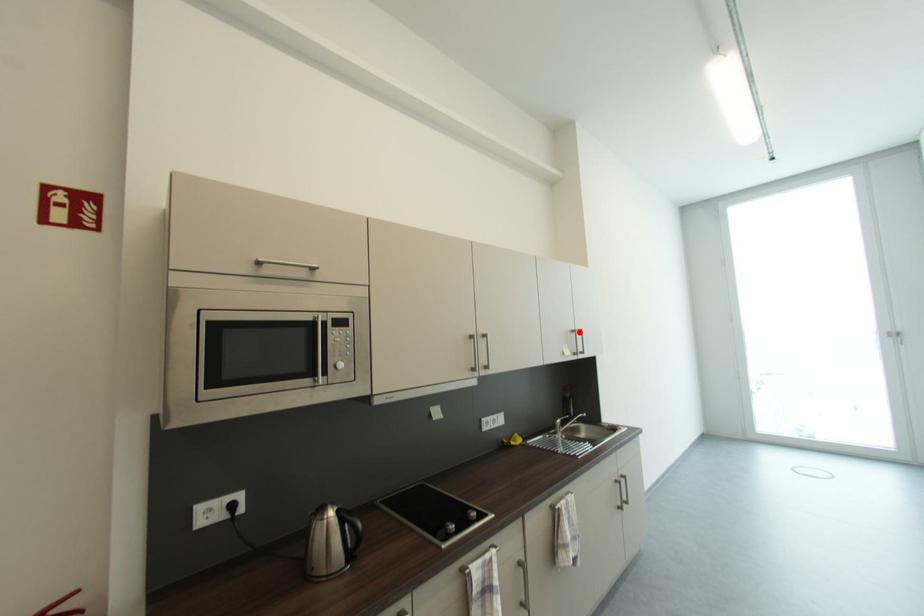
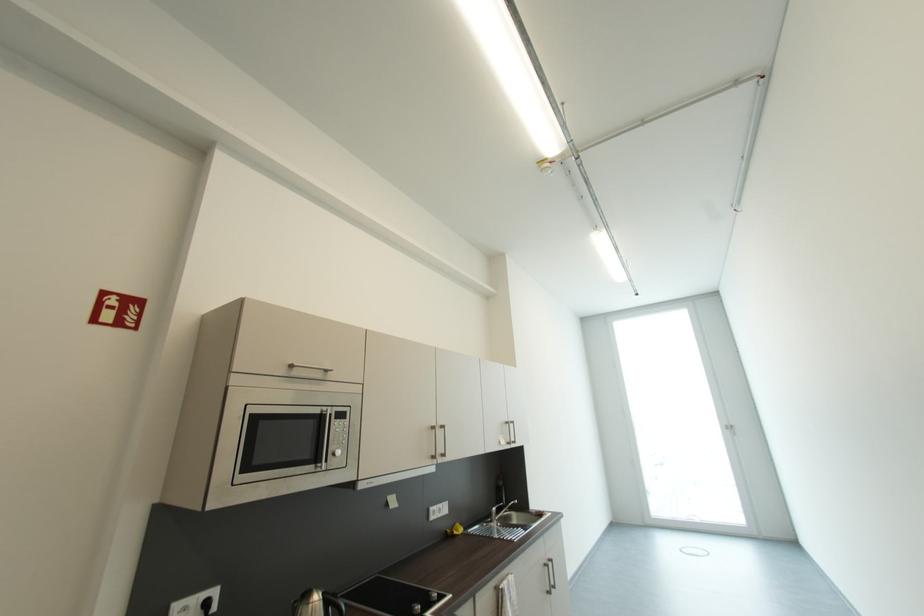
Question: I am providing you with two images of the same scene from different viewpoints. A red point is marked on the first image. At the location where the point appears in image 1, is it still visible in image 2?

Choices:
 (A) Yes
 (B) No

Answer: (A)